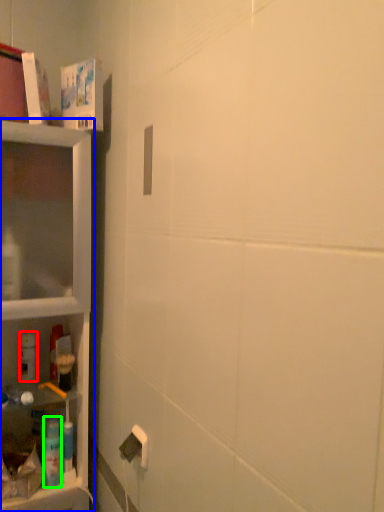
Question: Based on their relative distances, which object is nearer to cleaning product (highlighted by a red box)? Choose from shelf (highlighted by a blue box) and cleaning product (highlighted by a green box).

Choices:
 (A) shelf
 (B) cleaning product

Answer: (B)